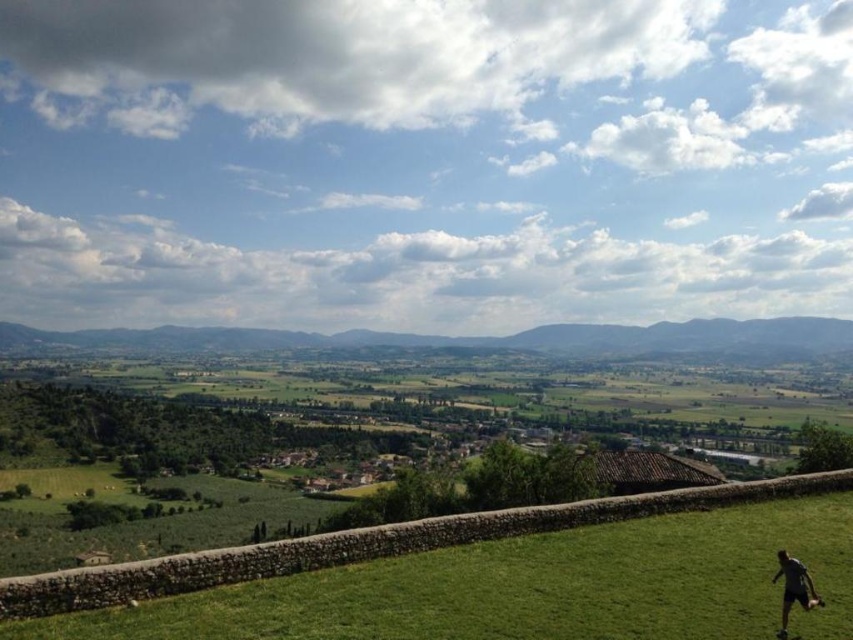
Does green grassy field at lower right have a smaller size compared to green grassy hillside at center?

Yes.

Does green grassy field at lower right lie behind green grassy hillside at center?

No, it is in front of green grassy hillside at center.

Identify the location of green grassy field at lower right. Image resolution: width=853 pixels, height=640 pixels. (531, 588).

Does green grassy field at lower right have a lesser height compared to dark gray shirt at lower right?

Yes, green grassy field at lower right is shorter than dark gray shirt at lower right.

Who is more distant from viewer, (759, 504) or (780, 614)?

Point (759, 504)

This screenshot has height=640, width=853. I want to click on green grassy field at lower right, so click(x=531, y=588).

What do you see at coordinates (468, 339) in the screenshot?
I see `green grassy hillside at center` at bounding box center [468, 339].

Can you confirm if green grassy hillside at center is shorter than dark gray shirt at lower right?

No, green grassy hillside at center is not shorter than dark gray shirt at lower right.

This screenshot has width=853, height=640. What do you see at coordinates (468, 339) in the screenshot? I see `green grassy hillside at center` at bounding box center [468, 339].

At what (x,y) coordinates should I click in order to perform the action: click on green grassy hillside at center. Please return your answer as a coordinate pair (x, y). The height and width of the screenshot is (640, 853). Looking at the image, I should click on (468, 339).